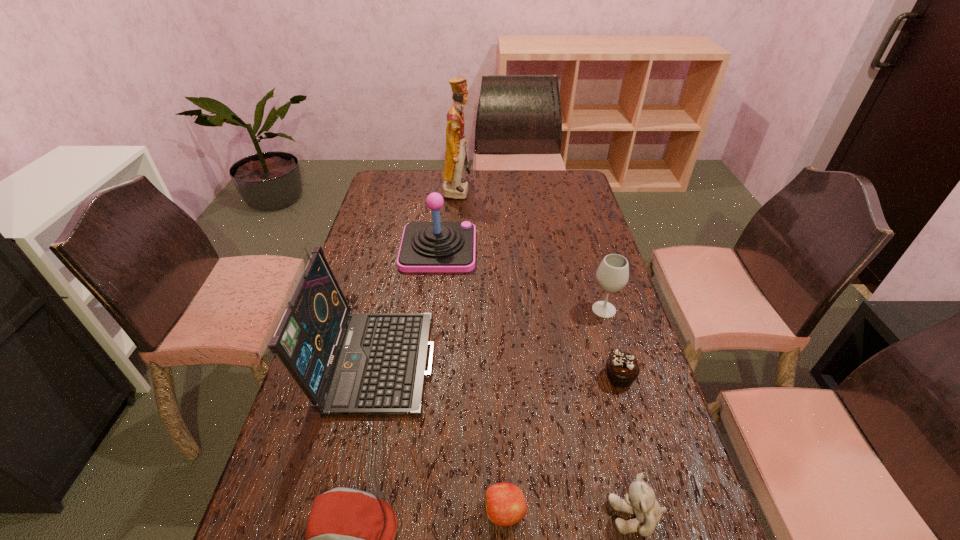
The width and height of the screenshot is (960, 540). In order to click on vacant area that satisfies the following two spatial constraints: 1. on the front-facing side of the second tallest object; 2. on the left side of the fourth object from right to left in this screenshot , I will do `click(341, 512)`.

The image size is (960, 540). I want to click on vacant area that satisfies the following two spatial constraints: 1. on the front-facing side of the wineglass; 2. on the left side of the tallest object, so click(x=449, y=310).